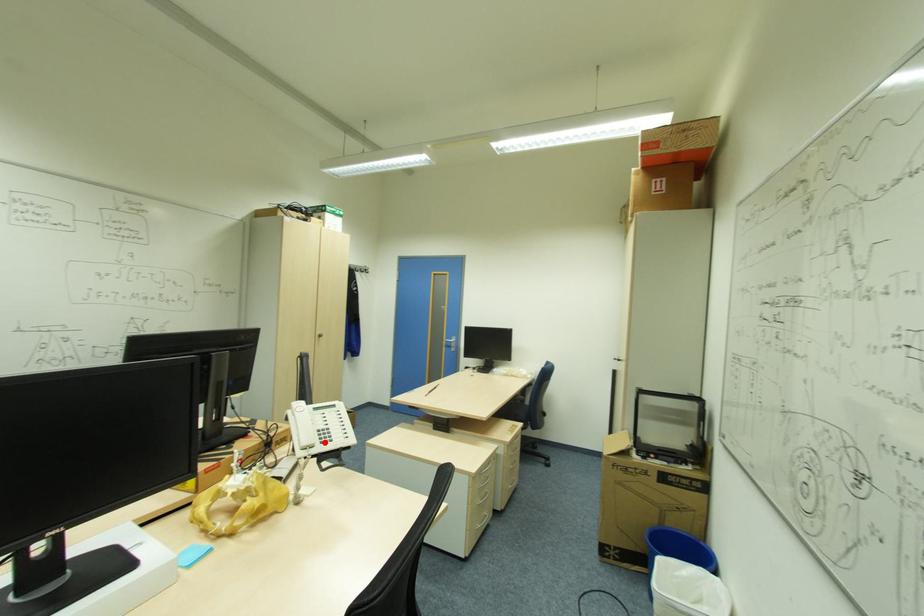
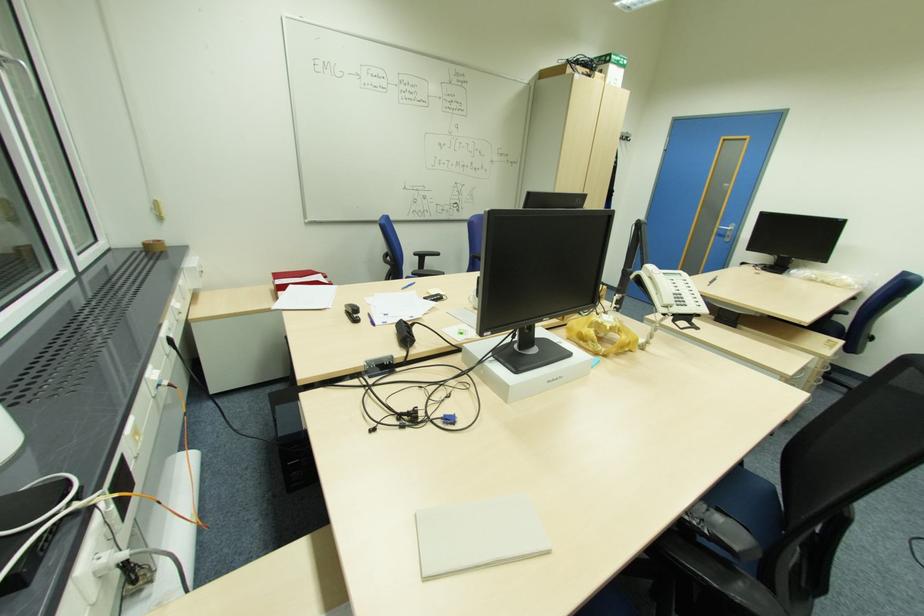
In the second image, find the point that corresponds to the highlighted location in the first image.

(681, 305)